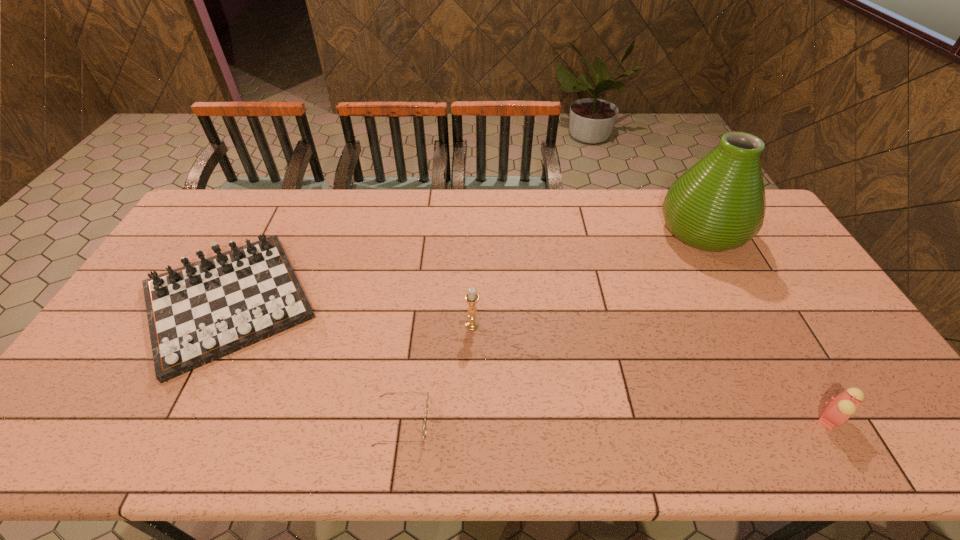
The width and height of the screenshot is (960, 540). Find the location of `vacant space at the near edge`. vacant space at the near edge is located at coordinates coord(839,451).

This screenshot has height=540, width=960. What are the coordinates of `free space at the left edge` in the screenshot? It's located at (208, 252).

Find the location of a particular element. The width and height of the screenshot is (960, 540). free space between the leftmost object and the shortest object is located at coordinates (315, 362).

The width and height of the screenshot is (960, 540). I want to click on free space that is in between the third object from right to left and the leftmost object, so click(x=350, y=313).

At what (x,y) coordinates should I click in order to perform the action: click on empty location between the leftmost object and the shortest object. Please return your answer as a coordinate pair (x, y). The width and height of the screenshot is (960, 540). Looking at the image, I should click on (315, 362).

Find the location of `free space between the shortest object and the tallest object`. free space between the shortest object and the tallest object is located at coordinates [x=552, y=327].

Where is `empty space that is in between the alarm clock and the second tallest object`? empty space that is in between the alarm clock and the second tallest object is located at coordinates (652, 372).

At what (x,y) coordinates should I click in order to perform the action: click on unoccupied area between the vase and the leftmost object. Please return your answer as a coordinate pair (x, y). Looking at the image, I should click on (466, 266).

Identify the location of free space between the leftmost object and the tallest object. The image size is (960, 540). (466, 266).

Where is `free space between the third object from right to left and the alarm clock`? This screenshot has width=960, height=540. free space between the third object from right to left and the alarm clock is located at coordinates point(652,372).